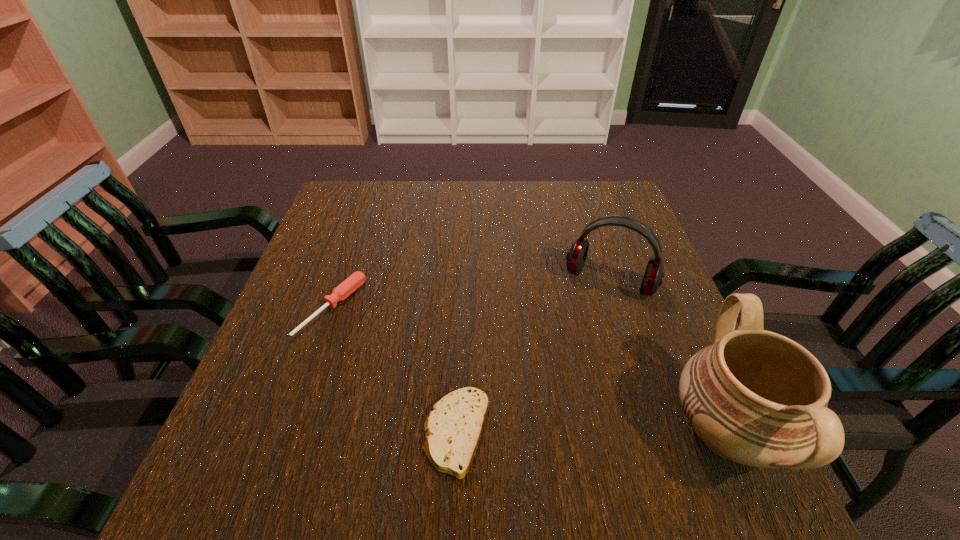
Where is `earphone that is at the right edge`? The width and height of the screenshot is (960, 540). earphone that is at the right edge is located at coordinates (576, 256).

The height and width of the screenshot is (540, 960). I want to click on object that is at the near right corner, so click(x=755, y=397).

The width and height of the screenshot is (960, 540). I want to click on vacant area at the far edge, so click(x=468, y=195).

Find the location of a particular element. free point at the left edge is located at coordinates (284, 384).

The height and width of the screenshot is (540, 960). Identify the location of free space at the right edge of the desktop. (666, 357).

This screenshot has height=540, width=960. In order to click on free space at the far left corner of the desktop in this screenshot , I will do `click(324, 223)`.

The width and height of the screenshot is (960, 540). What are the coordinates of `free space that is in between the urn and the shortest object` in the screenshot? It's located at (591, 433).

You are a GUI agent. You are given a task and a screenshot of the screen. Output one action in this format:
    pyautogui.click(x=<x>, y=<y>)
    Task: Click on the free area in between the urn and the third tallest object
    This screenshot has height=540, width=960.
    Given the screenshot: What is the action you would take?
    pyautogui.click(x=529, y=370)

This screenshot has height=540, width=960. In order to click on free point between the earphone and the pita bread in this screenshot , I will do (533, 357).

Locate an element on the screen. free spot between the earphone and the pita bread is located at coordinates (533, 357).